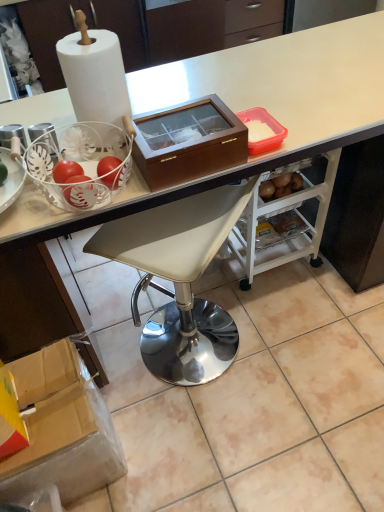
Question: Is there a large distance between cardboard box at lower left, placed as the 2th box when sorted from top to bottom, and brown wooden box at center, acting as the 1th box starting from the top?

Choices:
 (A) yes
 (B) no

Answer: (B)

Question: Can you confirm if cardboard box at lower left, the first box in the left-to-right sequence, is positioned to the right of brown wooden box at center, placed as the first box when sorted from right to left?

Choices:
 (A) yes
 (B) no

Answer: (B)

Question: Considering the relative sizes of cardboard box at lower left, the first box in the left-to-right sequence, and brown wooden box at center, placed as the first box when sorted from right to left, in the image provided, is cardboard box at lower left, the first box in the left-to-right sequence, thinner than brown wooden box at center, placed as the first box when sorted from right to left,?

Choices:
 (A) yes
 (B) no

Answer: (B)

Question: From the image's perspective, does cardboard box at lower left, marked as the second box in a right-to-left arrangement, appear lower than brown wooden box at center, acting as the 1th box starting from the top?

Choices:
 (A) yes
 (B) no

Answer: (A)

Question: Would you say cardboard box at lower left, the first box in the left-to-right sequence, contains brown wooden box at center, acting as the 1th box starting from the top?

Choices:
 (A) yes
 (B) no

Answer: (B)

Question: Is cardboard box at lower left, the first box in the left-to-right sequence, taller than brown wooden box at center, placed as the first box when sorted from right to left?

Choices:
 (A) no
 (B) yes

Answer: (B)

Question: Is white leather stool at center turned away from white glossy desk at upper center?

Choices:
 (A) no
 (B) yes

Answer: (B)

Question: Considering the relative sizes of white leather stool at center and white glossy desk at upper center in the image provided, is white leather stool at center smaller than white glossy desk at upper center?

Choices:
 (A) yes
 (B) no

Answer: (A)

Question: Can you see white leather stool at center touching white glossy desk at upper center?

Choices:
 (A) no
 (B) yes

Answer: (A)

Question: From a real-world perspective, is white leather stool at center positioned under white glossy desk at upper center based on gravity?

Choices:
 (A) no
 (B) yes

Answer: (B)

Question: Is white leather stool at center not inside white glossy desk at upper center?

Choices:
 (A) no
 (B) yes

Answer: (A)

Question: Does white leather stool at center have a greater height compared to white glossy desk at upper center?

Choices:
 (A) yes
 (B) no

Answer: (B)

Question: Can you confirm if white leather stool at center is wider than brown wooden box at center, placed as the first box when sorted from right to left?

Choices:
 (A) yes
 (B) no

Answer: (A)